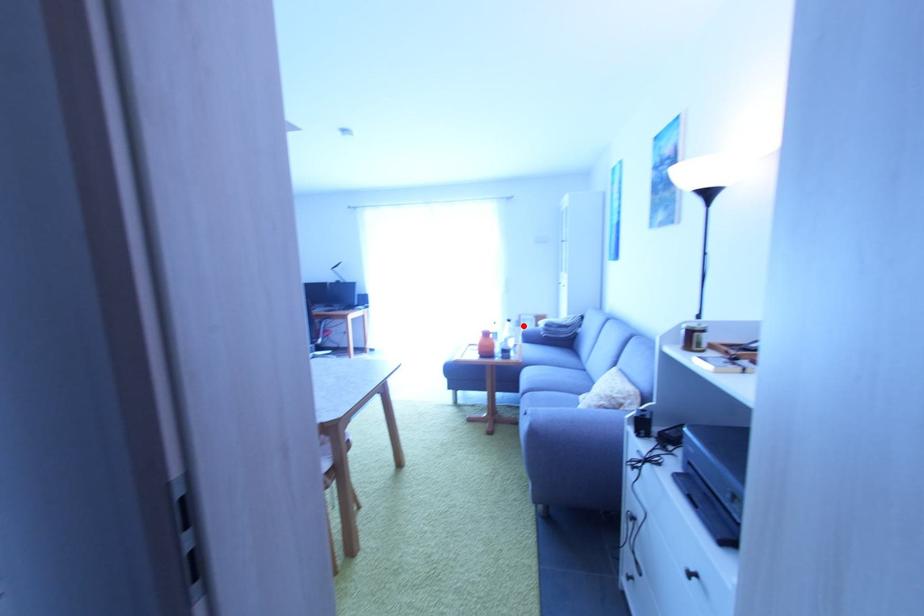
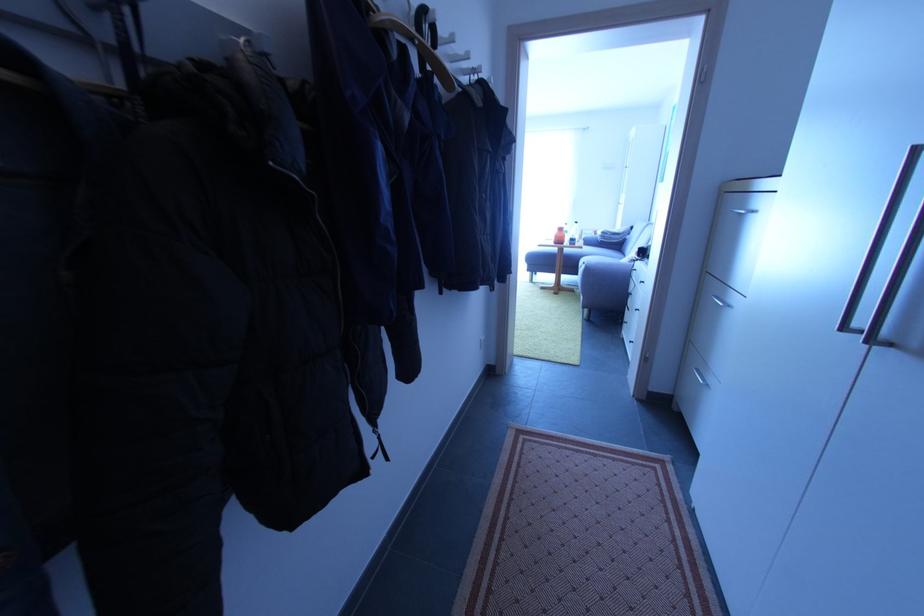
Question: I am providing you with two images of the same scene from different viewpoints. Given a red point in image1, look at the same physical point in image2. Is it:

Choices:
 (A) Closer to the viewpoint
 (B) Farther from the viewpoint

Answer: (A)